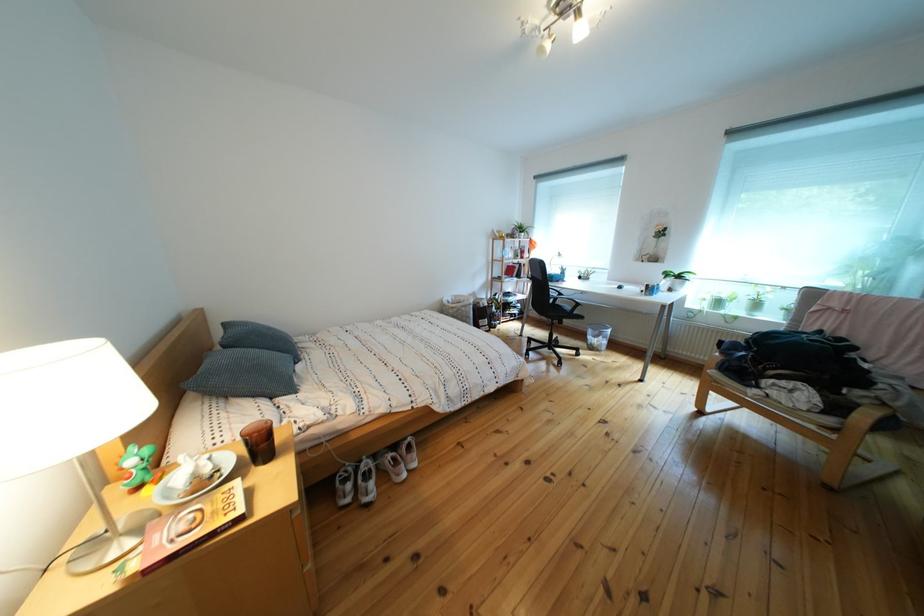
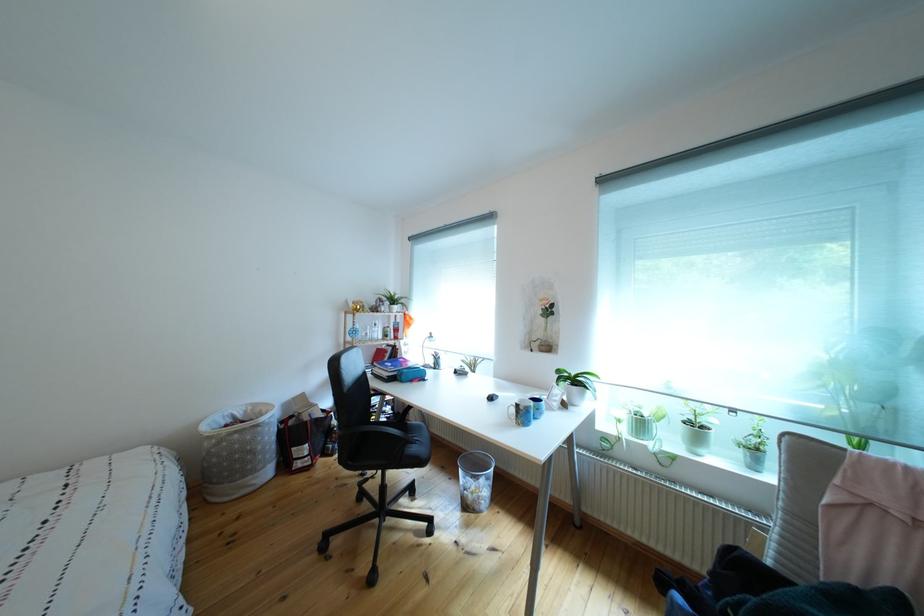
Locate, in the second image, the point that corresponds to pixel 659 292 in the first image.

(529, 411)